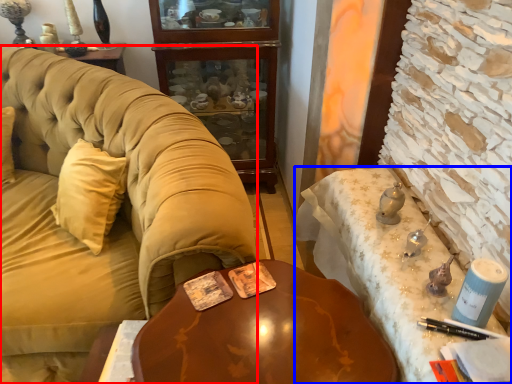
Question: Which object appears farthest to the camera in this image, studio couch (highlighted by a red box) or desk (highlighted by a blue box)?

Choices:
 (A) studio couch
 (B) desk

Answer: (A)